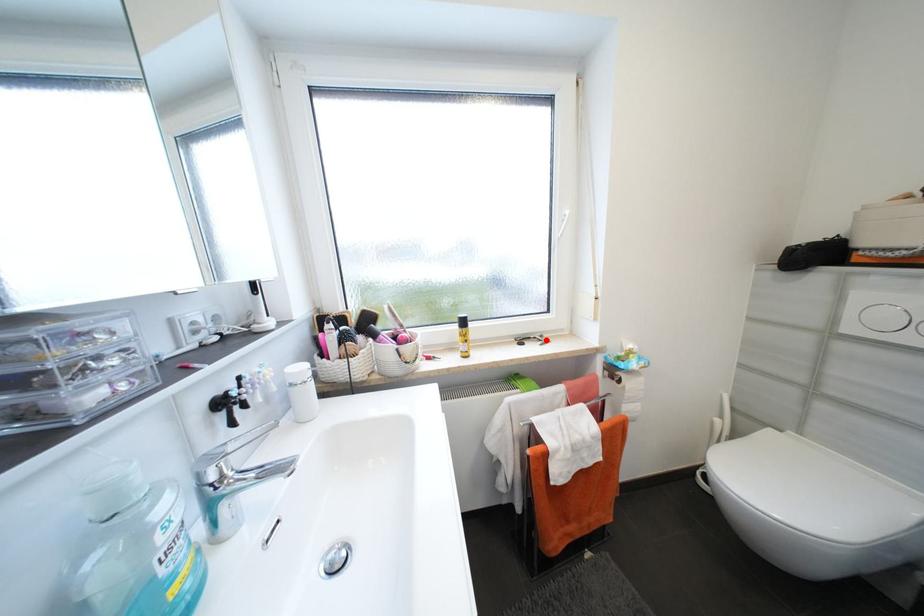
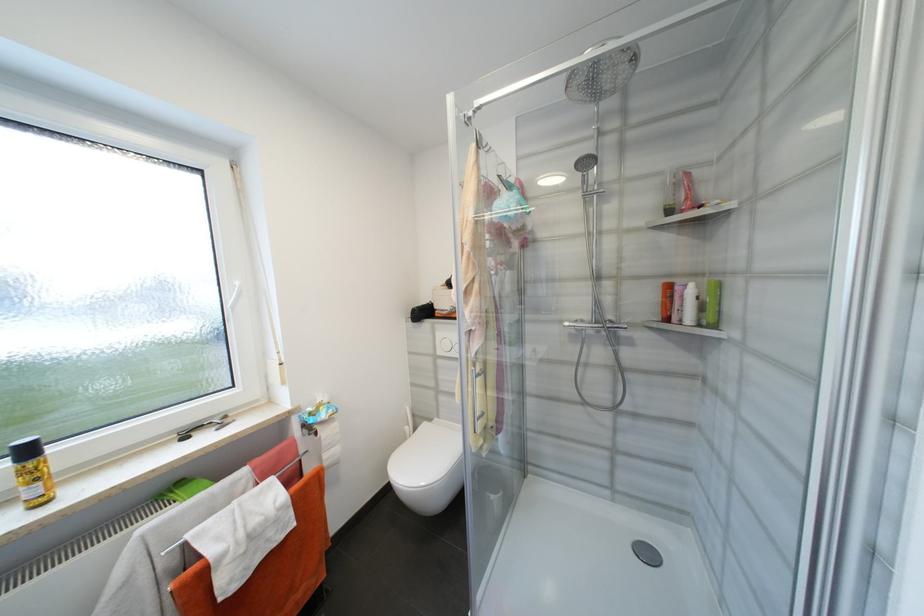
Question: I am providing you with two images of the same scene from different viewpoints. A red point is marked on the first image. At the location where the point appears in image 1, is it still visible in image 2?

Choices:
 (A) Yes
 (B) No

Answer: (A)